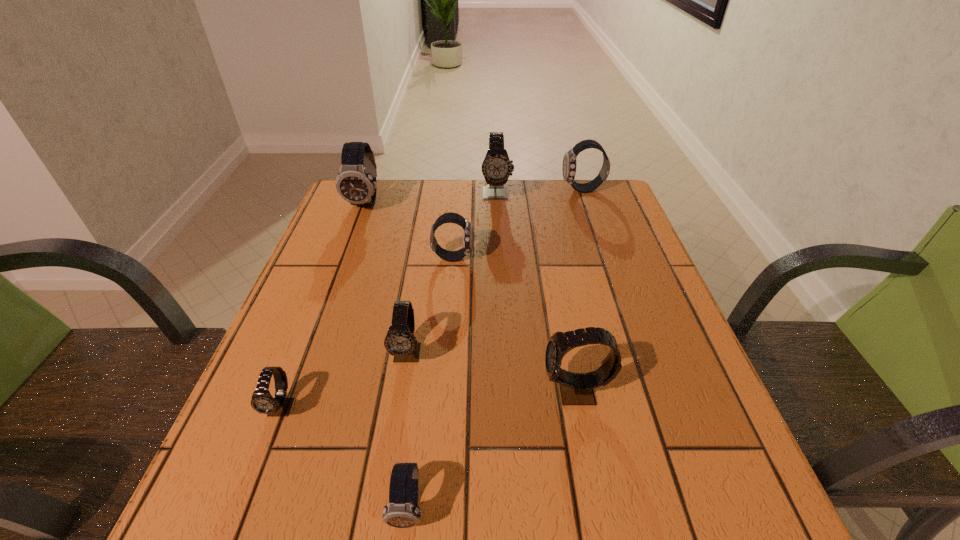
Identify the location of vacant area located 0.120m on the face of the rightmost gray watch. (475, 392).

This screenshot has width=960, height=540. Find the location of `vacant space located 0.320m on the face of the rightmost gray watch`. vacant space located 0.320m on the face of the rightmost gray watch is located at coordinates (363, 392).

Identify the location of vacant space located on the face of the third farthest dark watch. This screenshot has width=960, height=540. (522, 257).

At what (x,y) coordinates should I click in order to perform the action: click on free space located 0.120m on the face of the second gray watch from left to right. Please return your answer as a coordinate pair (x, y). The height and width of the screenshot is (540, 960). Looking at the image, I should click on (396, 433).

Locate an element on the screen. The width and height of the screenshot is (960, 540). vacant space positioned 0.120m on the face of the smallest gray watch is located at coordinates (246, 502).

Find the location of a particular element. object that is at the near edge is located at coordinates (402, 511).

What are the coordinates of `object located at the right edge` in the screenshot? It's located at (569, 166).

You are a GUI agent. You are given a task and a screenshot of the screen. Output one action in this format:
    pyautogui.click(x=<x>, y=<y>)
    Task: Click on the object at the far left corner
    The height and width of the screenshot is (540, 960).
    Given the screenshot: What is the action you would take?
    pyautogui.click(x=356, y=183)

Identify the location of object at the far right corner. The width and height of the screenshot is (960, 540). (569, 166).

The height and width of the screenshot is (540, 960). Find the location of `blank space at the far edge`. blank space at the far edge is located at coordinates (488, 208).